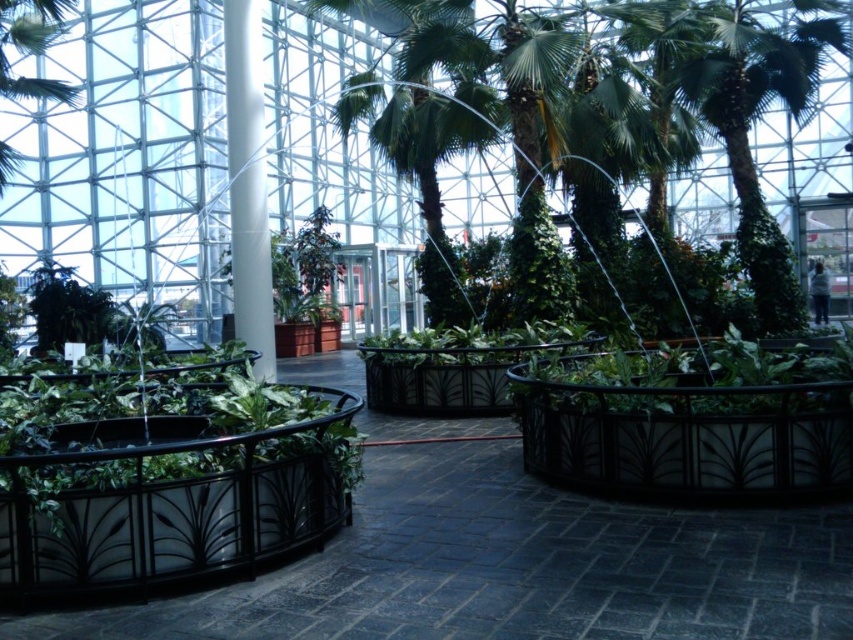
Question: Is the position of green leafy palm tree at center more distant than that of green leafy palm tree at upper left?

Choices:
 (A) no
 (B) yes

Answer: (B)

Question: Which point is closer to the camera taking this photo?

Choices:
 (A) (712, 97)
 (B) (54, 3)

Answer: (A)

Question: Does green leafy palm tree at center have a larger size compared to green leafy palm tree at upper left?

Choices:
 (A) no
 (B) yes

Answer: (A)

Question: Which point is farther to the camera?

Choices:
 (A) green leafy palm tree at upper left
 (B) green leafy palm tree at center

Answer: (B)

Question: Does green leafy palm tree at center appear under green leafy palm tree at upper left?

Choices:
 (A) no
 (B) yes

Answer: (B)